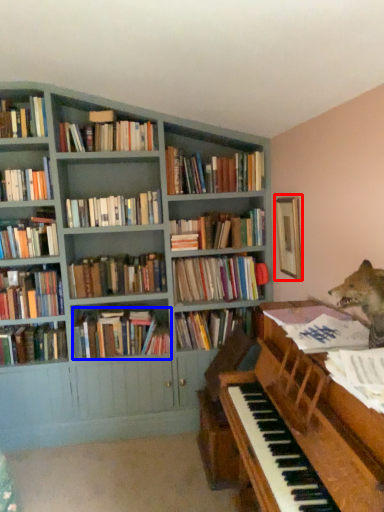
Question: Which of the following is the farthest to the observer, picture frame (highlighted by a red box) or book (highlighted by a blue box)?

Choices:
 (A) picture frame
 (B) book

Answer: (B)